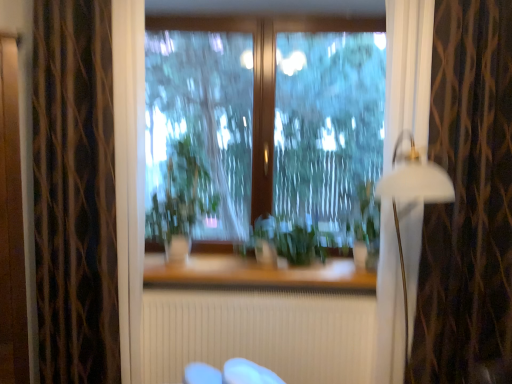
Question: From a real-world perspective, is dark brown textured curtain at left, placed as the 2th curtain when sorted from right to left, located higher than white matte lamp at right?

Choices:
 (A) yes
 (B) no

Answer: (A)

Question: Can you confirm if dark brown textured curtain at left, the first curtain from the left, is wider than white matte lamp at right?

Choices:
 (A) yes
 (B) no

Answer: (B)

Question: Does dark brown textured curtain at left, the first curtain from the left, have a smaller size compared to white matte lamp at right?

Choices:
 (A) no
 (B) yes

Answer: (A)

Question: Considering the relative sizes of dark brown textured curtain at left, the first curtain from the left, and white matte lamp at right in the image provided, is dark brown textured curtain at left, the first curtain from the left, taller than white matte lamp at right?

Choices:
 (A) yes
 (B) no

Answer: (A)

Question: From the image's perspective, is dark brown textured curtain at left, the first curtain from the left, located beneath white matte lamp at right?

Choices:
 (A) yes
 (B) no

Answer: (B)

Question: Could you tell me if dark brown textured curtain at left, the first curtain from the left, is facing white matte lamp at right?

Choices:
 (A) no
 (B) yes

Answer: (A)

Question: From the image's perspective, is green leafy plant at center, which is the 2th plant from right to left, below white matte lamp at right?

Choices:
 (A) no
 (B) yes

Answer: (A)

Question: From a real-world perspective, is green leafy plant at center, acting as the first plant starting from the left, below white matte lamp at right?

Choices:
 (A) yes
 (B) no

Answer: (B)

Question: Is green leafy plant at center, acting as the first plant starting from the left, thinner than white matte lamp at right?

Choices:
 (A) yes
 (B) no

Answer: (B)

Question: Considering the relative positions of green leafy plant at center, which is the 2th plant from right to left, and white matte lamp at right in the image provided, is green leafy plant at center, which is the 2th plant from right to left, behind white matte lamp at right?

Choices:
 (A) yes
 (B) no

Answer: (A)

Question: Is green leafy plant at center, acting as the first plant starting from the left, smaller than white matte lamp at right?

Choices:
 (A) no
 (B) yes

Answer: (B)

Question: Can you confirm if green leafy plant at center, acting as the first plant starting from the left, is taller than white matte lamp at right?

Choices:
 (A) no
 (B) yes

Answer: (A)

Question: Does transparent glass window at center turn towards green leafy plant at center, which is the 2th plant from right to left?

Choices:
 (A) no
 (B) yes

Answer: (B)